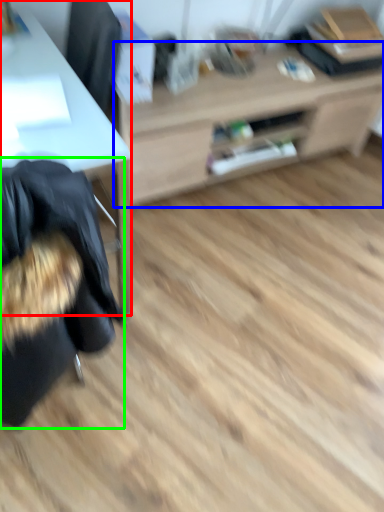
Question: Considering the real-world distances, which object is farthest from desk (highlighted by a red box)? table (highlighted by a blue box) or bean bag chair (highlighted by a green box)?

Choices:
 (A) table
 (B) bean bag chair

Answer: (A)